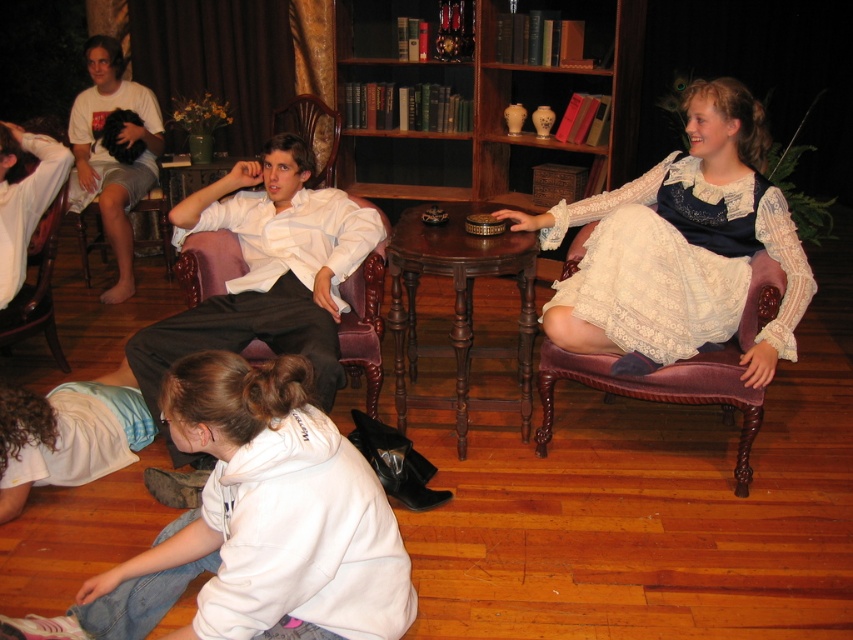
Is white lace dress at center wider than brown velvet armchair at left?

Correct, the width of white lace dress at center exceeds that of brown velvet armchair at left.

Is point (656, 168) positioned before point (158, 228)?

Yes, point (656, 168) is closer to viewer.

Where is `white lace dress at center`? white lace dress at center is located at coordinates (680, 246).

What do you see at coordinates (488, 99) in the screenshot? The width and height of the screenshot is (853, 640). I see `wooden bookshelf at upper center` at bounding box center [488, 99].

Is point (404, 200) closer to camera compared to point (167, 266)?

No, it is behind (167, 266).

Which is behind, point (488, 122) or point (79, 227)?

Positioned behind is point (488, 122).

At what (x,y) coordinates should I click in order to perform the action: click on wooden bookshelf at upper center. Please return your answer as a coordinate pair (x, y). This screenshot has height=640, width=853. Looking at the image, I should click on (488, 99).

Who is more forward, (399, 180) or (759, 275)?

Point (759, 275)

Which is more to the right, wooden bookshelf at upper center or velvet purple armchair at right?

velvet purple armchair at right is more to the right.

Which is in front, point (482, 172) or point (550, 426)?

Point (550, 426) is in front.

The width and height of the screenshot is (853, 640). What are the coordinates of `wooden bookshelf at upper center` in the screenshot? It's located at (488, 99).